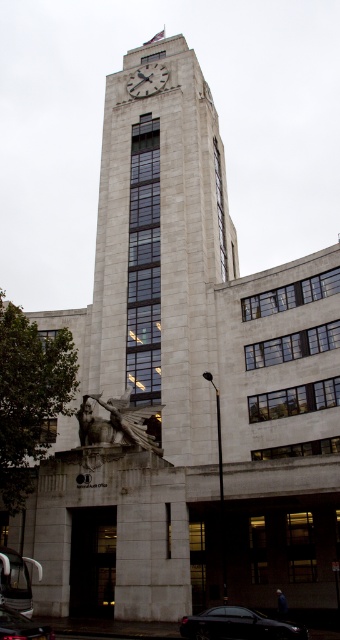
Is shiny black car at lower left in front of white stone clock at upper center?

Yes.

Who is more forward, (39,627) or (161,68)?

Point (39,627)

Image resolution: width=340 pixels, height=640 pixels. Find the location of `shiny black car at lower left`. shiny black car at lower left is located at coordinates (21, 627).

Between point (200, 624) and point (7, 625), which one is positioned in front?

Point (7, 625)

At what (x,y) coordinates should I click in order to perform the action: click on shiny black car at lower center. Please return your answer as a coordinate pair (x, y). This screenshot has width=340, height=640. Looking at the image, I should click on (237, 625).

Is point (76, 412) farther from viewer compared to point (155, 92)?

No, (76, 412) is in front of (155, 92).

Where is `bronze statue at lower left`? This screenshot has height=640, width=340. bronze statue at lower left is located at coordinates (116, 422).

You are a GUI agent. You are given a task and a screenshot of the screen. Output one action in this format:
    pyautogui.click(x=<x>, y=<y>)
    Task: Click on the bronze statue at lower left
    The image size is (340, 640).
    Given the screenshot: What is the action you would take?
    pyautogui.click(x=116, y=422)